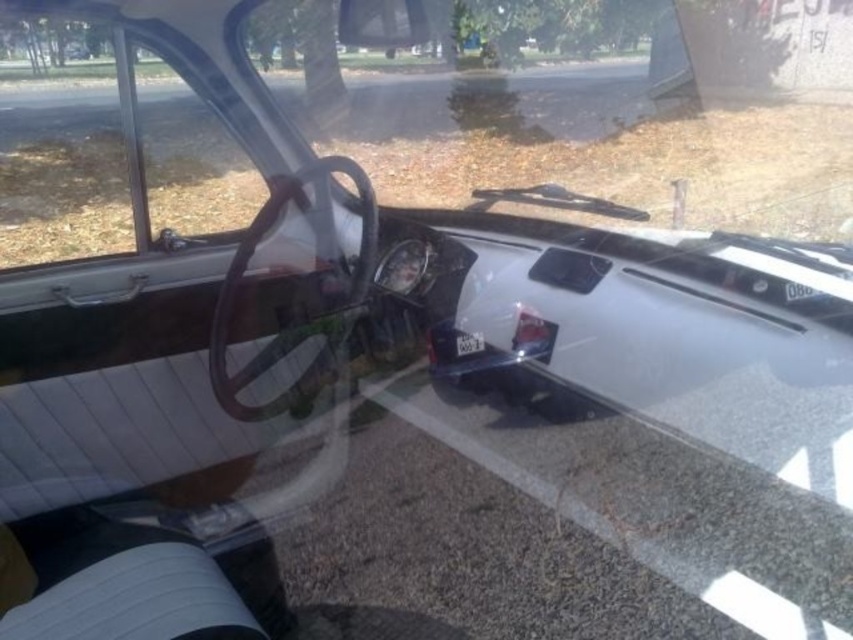
Which of these two, transparent glass windshield at center or clear glass window at left, stands taller?

clear glass window at left is taller.

Who is more forward, [662,120] or [169,163]?

Point [169,163]

Is point (335, 125) positioned in front of point (170, 92)?

Yes, point (335, 125) is closer to viewer.

This screenshot has width=853, height=640. I want to click on transparent glass windshield at center, so click(596, 108).